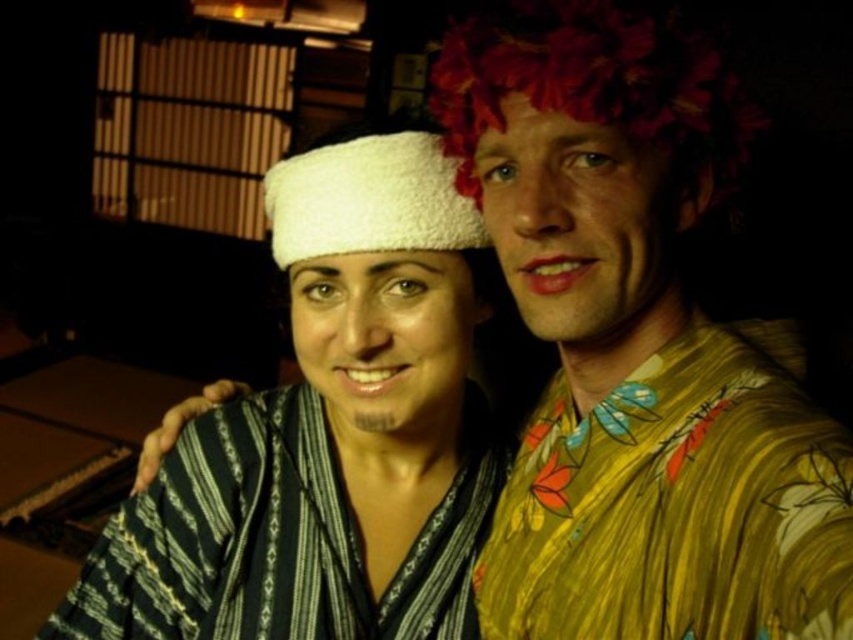
Question: Does striped fabric kimono at center appear on the right side of white fluffy bandage at center?

Choices:
 (A) yes
 (B) no

Answer: (B)

Question: Is striped fabric kimono at center further to the viewer compared to striped cotton robe at center?

Choices:
 (A) no
 (B) yes

Answer: (A)

Question: Which of the following is the closest to the observer?

Choices:
 (A) (463, 129)
 (B) (688, 92)
 (C) (753, 536)

Answer: (C)

Question: Does striped cotton robe at center appear on the left side of white fluffy bandage at center?

Choices:
 (A) yes
 (B) no

Answer: (A)

Question: Based on their relative distances, which object is farther from the striped fabric kimono at center?

Choices:
 (A) floral fabric headband at upper right
 (B) floral-patterned shirt at upper right
 (C) white fluffy bandage at center
 (D) yellow floral robe at right

Answer: (A)

Question: Estimate the real-world distances between objects in this image. Which object is farther from the striped fabric kimono at center?

Choices:
 (A) white fluffy bandage at center
 (B) striped cotton robe at center
 (C) floral-patterned shirt at upper right

Answer: (C)